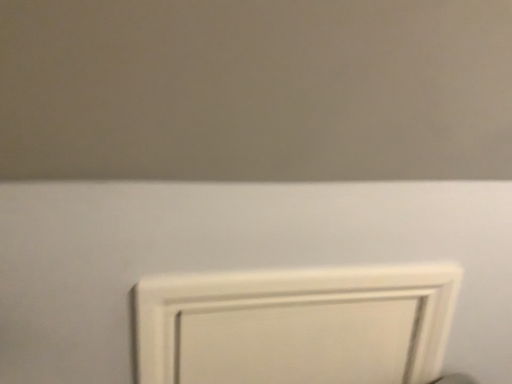
Image resolution: width=512 pixels, height=384 pixels. Describe the element at coordinates (296, 325) in the screenshot. I see `white matte door at lower center` at that location.

I want to click on white matte door at lower center, so click(x=296, y=325).

Identify the location of white matte door at lower center. The width and height of the screenshot is (512, 384). (296, 325).